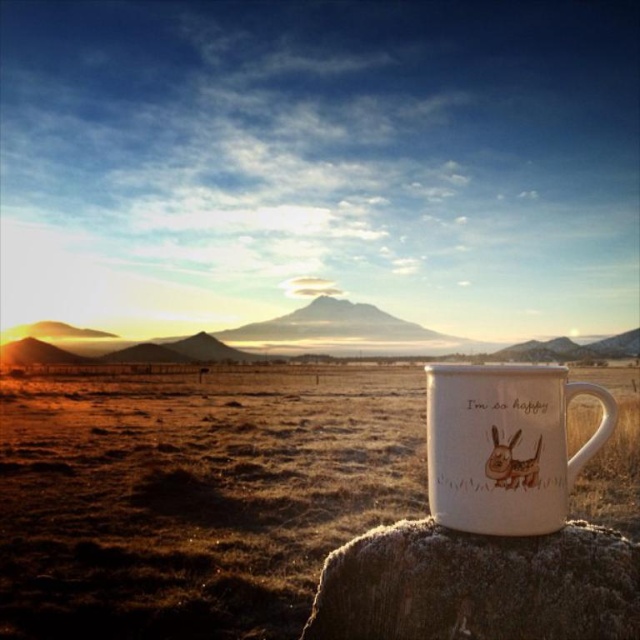
Question: Among these points, which one is nearest to the camera?

Choices:
 (A) (428, 440)
 (B) (445, 604)
 (C) (49, 499)

Answer: (B)

Question: Which object is positioned closest to the white matte cup at center?

Choices:
 (A) white ceramic mug at lower right
 (B) white frosty rock at lower center

Answer: (B)

Question: Which point appears farthest from the camera in this image?

Choices:
 (A) (618, 451)
 (B) (508, 598)
 (C) (560, 413)

Answer: (A)

Question: Is white matte cup at center behind white frosty rock at lower center?

Choices:
 (A) no
 (B) yes

Answer: (B)

Question: Can you confirm if white matte cup at center is positioned to the left of white frosty rock at lower center?

Choices:
 (A) yes
 (B) no

Answer: (A)

Question: Can you confirm if white matte cup at center is positioned below white frosty rock at lower center?

Choices:
 (A) yes
 (B) no

Answer: (A)